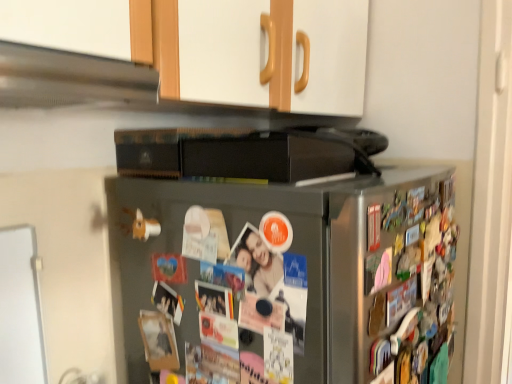
Question: Is point (x=282, y=253) closer or farther from the camera than point (x=126, y=77)?

Choices:
 (A) farther
 (B) closer

Answer: (A)

Question: Do you think satin silver refrigerator at center is within satin silver exhaust hood at upper left, or outside of it?

Choices:
 (A) inside
 (B) outside

Answer: (B)

Question: From a real-world perspective, relative to satin silver exhaust hood at upper left, is satin silver refrigerator at center vertically above or below?

Choices:
 (A) above
 (B) below

Answer: (B)

Question: Is satin silver exhaust hood at upper left to the left or to the right of satin silver refrigerator at center in the image?

Choices:
 (A) right
 (B) left

Answer: (B)

Question: Is point (7, 49) positioned closer to the camera than point (223, 269)?

Choices:
 (A) closer
 (B) farther

Answer: (A)

Question: Considering the positions of satin silver exhaust hood at upper left and satin silver refrigerator at center in the image, is satin silver exhaust hood at upper left taller or shorter than satin silver refrigerator at center?

Choices:
 (A) short
 (B) tall

Answer: (A)

Question: From a real-world perspective, is satin silver exhaust hood at upper left above or below satin silver refrigerator at center?

Choices:
 (A) below
 (B) above

Answer: (B)